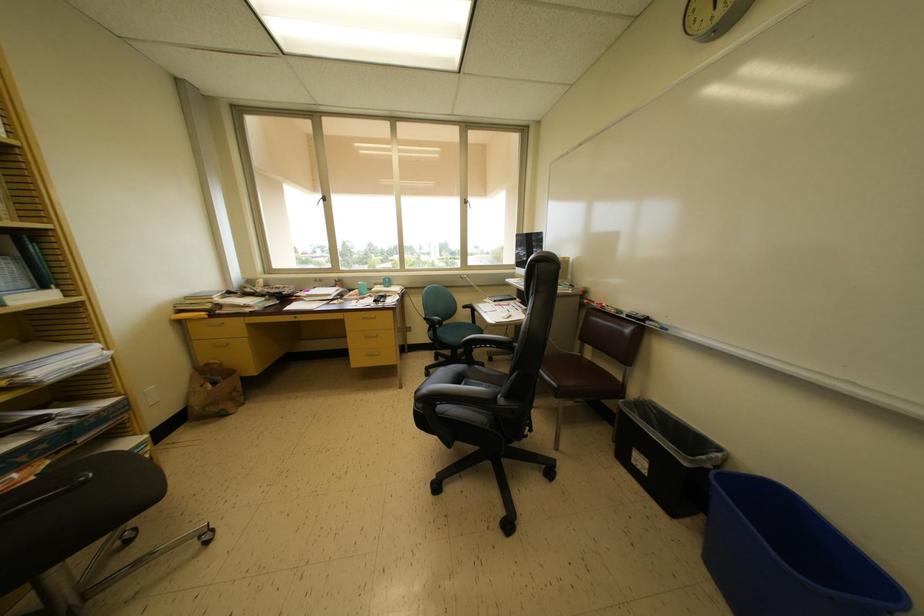
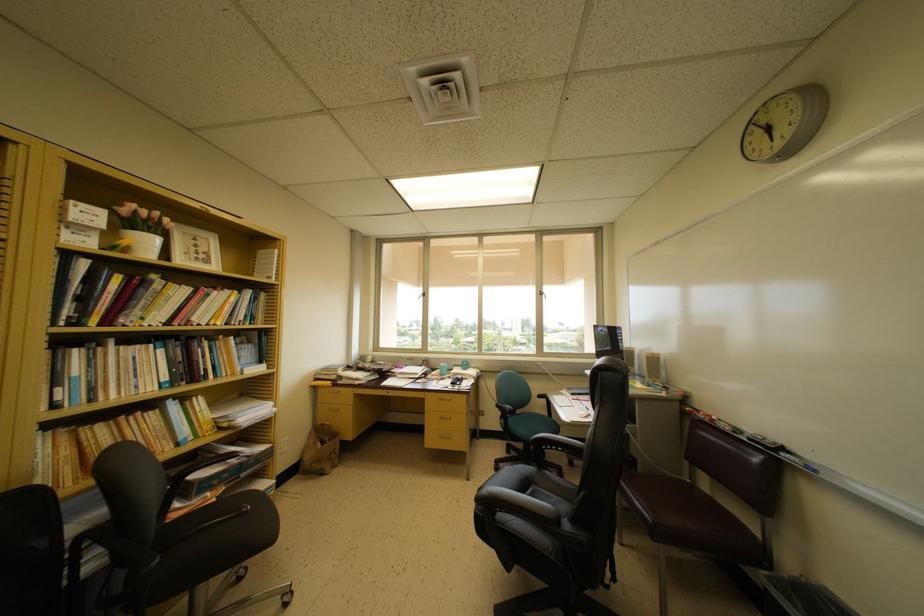
The point at (434, 376) is marked in the first image. Where is the corresponding point in the second image?

(504, 469)